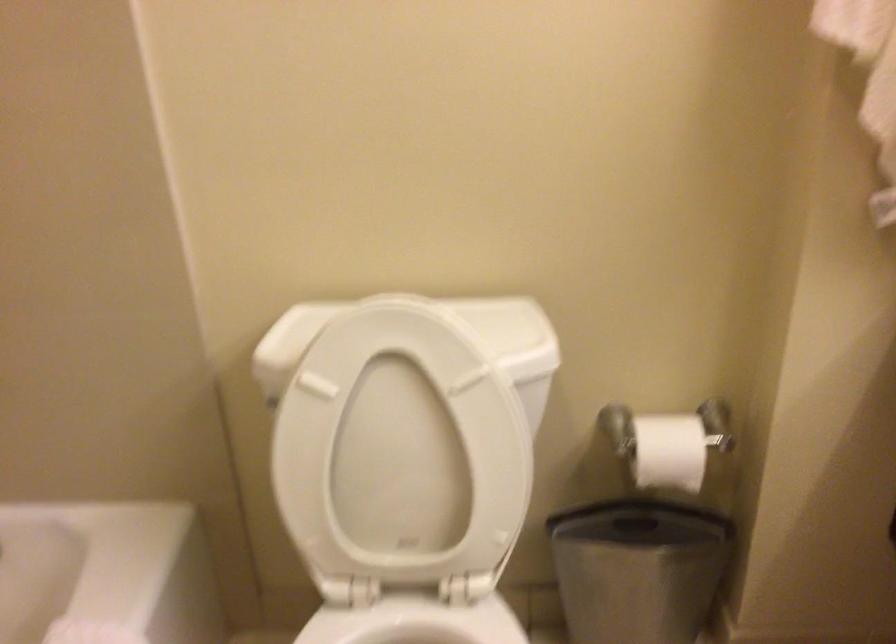
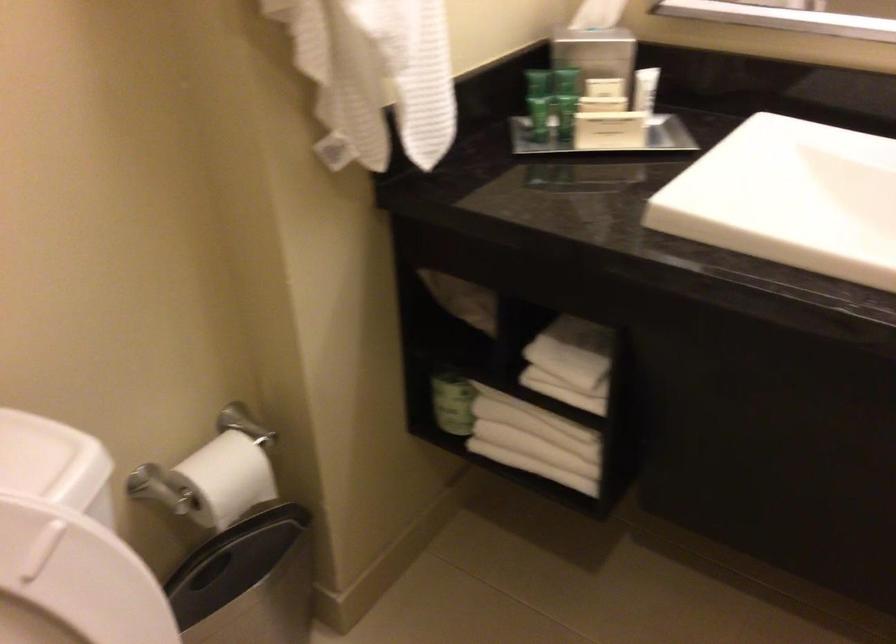
Find the pixel in the second image that matches (650,439) in the first image.

(211, 480)